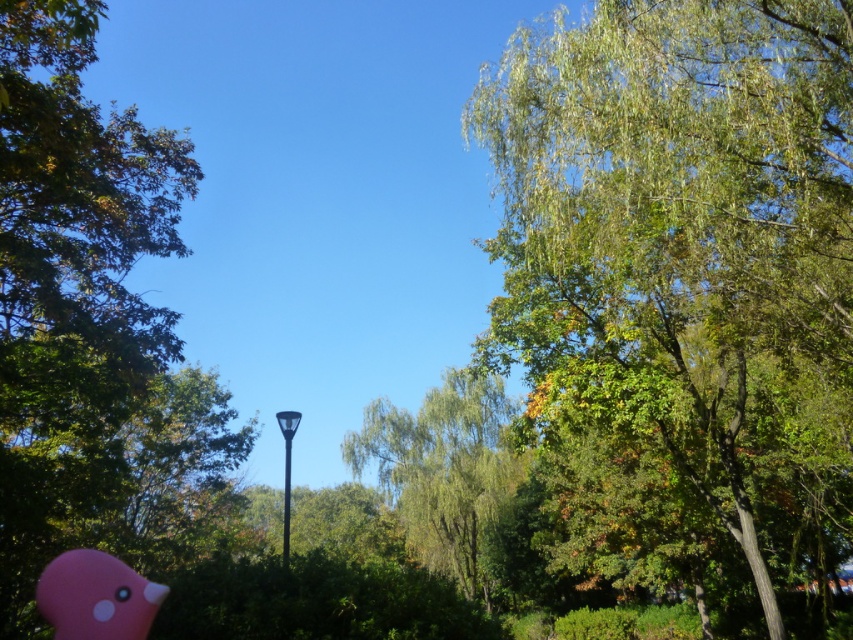
Can you confirm if pink matte toy at lower left is positioned to the right of black metal lamp post at center?

Correct, you'll find pink matte toy at lower left to the right of black metal lamp post at center.

Is pink matte toy at lower left closer to the viewer compared to black metal lamp post at center?

That is True.

The image size is (853, 640). Describe the element at coordinates (96, 596) in the screenshot. I see `pink matte toy at lower left` at that location.

At what (x,y) coordinates should I click in order to perform the action: click on pink matte toy at lower left. Please return your answer as a coordinate pair (x, y). The image size is (853, 640). Looking at the image, I should click on (96, 596).

Can you confirm if green leafy tree at left is positioned above black metal lamp post at center?

Yes.

Is green leafy tree at left thinner than black metal lamp post at center?

No.

The width and height of the screenshot is (853, 640). What are the coordinates of `green leafy tree at left` in the screenshot? It's located at (90, 323).

Does green leafy tree at upper right appear on the left side of pink matte toy at lower left?

No, green leafy tree at upper right is not to the left of pink matte toy at lower left.

Who is more distant from viewer, [677,232] or [109,564]?

The point [109,564] is behind.

You are a GUI agent. You are given a task and a screenshot of the screen. Output one action in this format:
    pyautogui.click(x=<x>, y=<y>)
    Task: Click on the green leafy tree at upper right
    
    Given the screenshot: What is the action you would take?
    pyautogui.click(x=685, y=276)